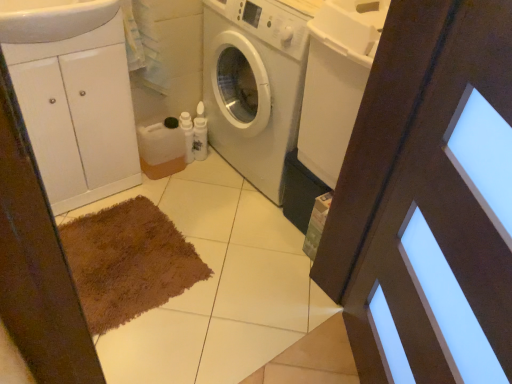
What do you see at coordinates (73, 96) in the screenshot? I see `white glossy cabinet at left` at bounding box center [73, 96].

What do you see at coordinates (445, 218) in the screenshot? I see `brown wooden screen door at center` at bounding box center [445, 218].

What is the approximate height of white matte washing machine at center?

33.42 inches.

Image resolution: width=512 pixels, height=384 pixels. I want to click on white glossy cabinet at left, so click(73, 96).

Can you confirm if brown wooden screen door at center is taller than white glossy sink at upper left?

Indeed, brown wooden screen door at center has a greater height compared to white glossy sink at upper left.

Looking at this image, considering the relative positions of brown wooden screen door at center and white glossy sink at upper left in the image provided, is brown wooden screen door at center to the left of white glossy sink at upper left from the viewer's perspective?

Incorrect, brown wooden screen door at center is not on the left side of white glossy sink at upper left.

Is brown wooden screen door at center facing away from white glossy sink at upper left?

No, brown wooden screen door at center is not facing away from white glossy sink at upper left.

Is point (398, 264) behind point (87, 19)?

No, (398, 264) is closer to viewer.

Does white glossy sink at upper left have a smaller size compared to white matte washing machine at center?

Correct, white glossy sink at upper left occupies less space than white matte washing machine at center.

In terms of width, does white glossy sink at upper left look wider or thinner when compared to white matte washing machine at center?

In the image, white glossy sink at upper left appears to be more narrow than white matte washing machine at center.

Is white glossy sink at upper left to the right of white matte washing machine at center from the viewer's perspective?

No, white glossy sink at upper left is not to the right of white matte washing machine at center.

From a real-world perspective, is white glossy sink at upper left positioned under white glossy cabinet at left based on gravity?

No.

Does white glossy sink at upper left have a greater width compared to white glossy cabinet at left?

Yes, white glossy sink at upper left is wider than white glossy cabinet at left.

Who is bigger, white glossy sink at upper left or white glossy cabinet at left?

With larger size is white glossy cabinet at left.

Between white matte washing machine at center and brown wooden screen door at center, which one has larger size?

Bigger between the two is white matte washing machine at center.

Would you say white matte washing machine at center is outside brown wooden screen door at center?

white matte washing machine at center lies outside brown wooden screen door at center's area.

From the image's perspective, is white matte washing machine at center located above brown wooden screen door at center?

Yes, from the image's perspective, white matte washing machine at center is above brown wooden screen door at center.

From a real-world perspective, does white matte washing machine at center stand above brown wooden screen door at center?

No, from a real-world perspective, white matte washing machine at center is not above brown wooden screen door at center.

Which is nearer, (389, 295) or (238, 86)?

Point (389, 295) appears to be closer to the viewer than point (238, 86).

From the image's perspective, does brown wooden screen door at center appear higher than white matte washing machine at center?

No, from the image's perspective, brown wooden screen door at center is not over white matte washing machine at center.

This screenshot has height=384, width=512. Identify the location of washing machine below the brown wooden screen door at center (from a real-world perspective). (255, 83).

What's the angular difference between brown wooden screen door at center and white matte washing machine at center's facing directions?

The angle between the facing direction of brown wooden screen door at center and the facing direction of white matte washing machine at center is 41.9 degrees.

Considering the positions of objects white glossy cabinet at left and brown wooden screen door at center in the image provided, who is more to the left, white glossy cabinet at left or brown wooden screen door at center?

white glossy cabinet at left.

Is white glossy cabinet at left facing towards brown wooden screen door at center?

Yes, white glossy cabinet at left is facing brown wooden screen door at center.

Who is more distant, white glossy cabinet at left or brown wooden screen door at center?

Positioned behind is white glossy cabinet at left.

How far apart are brown wooden screen door at center and white glossy cabinet at left?

brown wooden screen door at center and white glossy cabinet at left are 3.65 feet apart.

Can you confirm if brown wooden screen door at center is bigger than white glossy cabinet at left?

Yes, brown wooden screen door at center is bigger than white glossy cabinet at left.

Identify the location of cabinetry that is on the left side of brown wooden screen door at center. (73, 96).

Which object is wider, brown wooden screen door at center or white glossy cabinet at left?

With larger width is white glossy cabinet at left.

This screenshot has width=512, height=384. Find the location of `screen door below the white glossy sink at upper left (from a real-world perspective)`. screen door below the white glossy sink at upper left (from a real-world perspective) is located at coordinates (445, 218).

The width and height of the screenshot is (512, 384). I want to click on sink in front of the white matte washing machine at center, so click(52, 19).

Looking at the image, which one is located further to white matte washing machine at center, white glossy cabinet at left or brown wooden screen door at center?

brown wooden screen door at center lies further to white matte washing machine at center than the other object.

Looking at the image, which one is located closer to white matte washing machine at center, white glossy cabinet at left or white glossy sink at upper left?

Among the two, white glossy cabinet at left is located nearer to white matte washing machine at center.

Estimate the real-world distances between objects in this image. Which object is further from white glossy sink at upper left, brown wooden screen door at center or white glossy cabinet at left?

brown wooden screen door at center is positioned further to the anchor white glossy sink at upper left.

Estimate the real-world distances between objects in this image. Which object is closer to brown wooden screen door at center, white glossy cabinet at left or white glossy sink at upper left?

white glossy cabinet at left is closer to brown wooden screen door at center.

Looking at the image, which one is located further to brown wooden screen door at center, white glossy sink at upper left or white glossy cabinet at left?

The object further to brown wooden screen door at center is white glossy sink at upper left.

When comparing their distances from white glossy sink at upper left, does brown wooden screen door at center or white matte washing machine at center seem further?

brown wooden screen door at center is positioned further to the anchor white glossy sink at upper left.

Looking at the image, which one is located closer to brown wooden screen door at center, white glossy sink at upper left or white matte washing machine at center?

white matte washing machine at center lies closer to brown wooden screen door at center than the other object.

From the picture: Looking at the image, which one is located further to white glossy sink at upper left, white glossy cabinet at left or white matte washing machine at center?

white matte washing machine at center is positioned further to the anchor white glossy sink at upper left.

Where is `washing machine between white glossy cabinet at left and brown wooden screen door at center from left to right`? This screenshot has width=512, height=384. washing machine between white glossy cabinet at left and brown wooden screen door at center from left to right is located at coordinates (255, 83).

Locate an element on the screen. The image size is (512, 384). sink located between brown wooden screen door at center and white matte washing machine at center in the depth direction is located at coordinates click(x=52, y=19).

Locate an element on the screen. sink situated between white glossy cabinet at left and brown wooden screen door at center from left to right is located at coordinates (52, 19).

Find the location of a particular element. This screenshot has width=512, height=384. sink situated between white glossy cabinet at left and white matte washing machine at center from left to right is located at coordinates (52, 19).